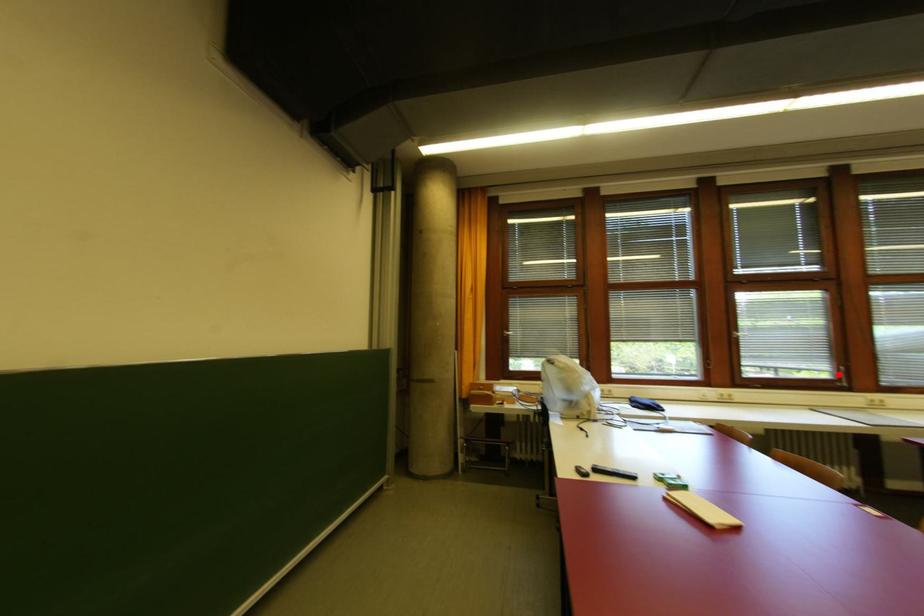
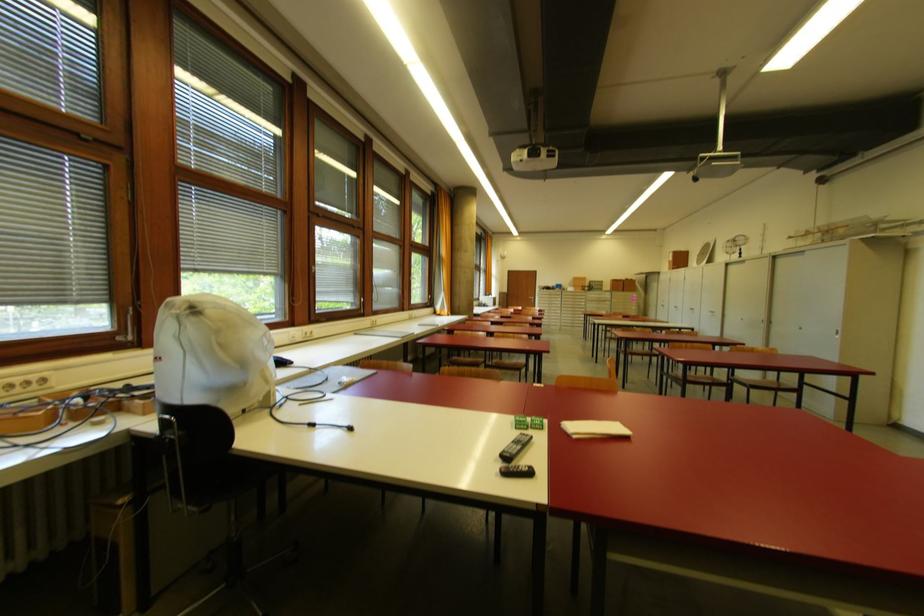
Where in the second image is the point corresponding to the highlighted location from the first image?

(360, 305)